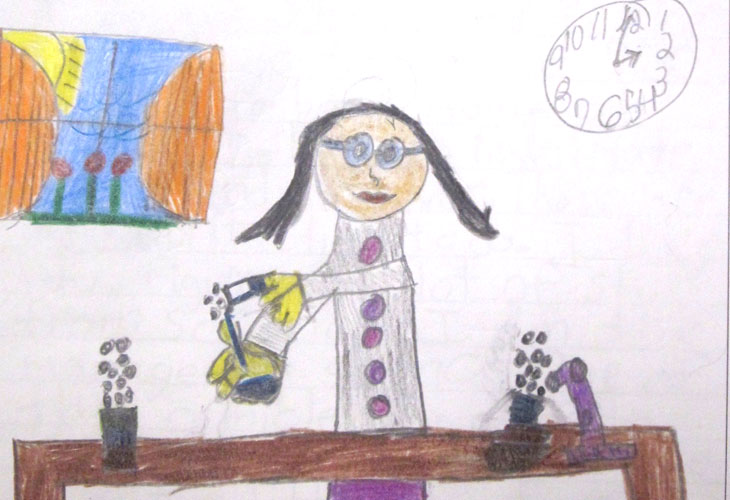
Where is `"6" in clock`? The image size is (730, 500). "6" in clock is located at coordinates (607, 114).